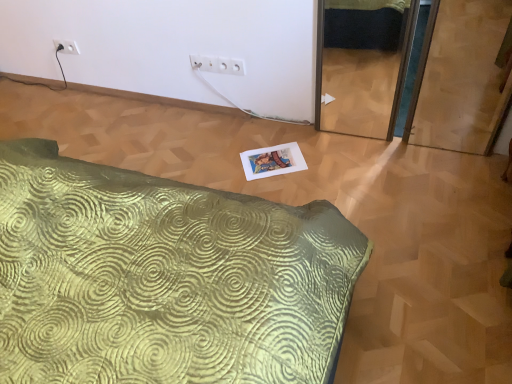
Question: Is white plastic outlet at upper center, the second electric outlet in the back-to-front sequence, further to camera compared to white plastic electric outlet at upper left, placed as the 1th electric outlet when sorted from left to right?

Choices:
 (A) no
 (B) yes

Answer: (A)

Question: From the image's perspective, would you say white plastic outlet at upper center, which appears as the 1th electric outlet when viewed from the right, is shown under white plastic electric outlet at upper left, the second electric outlet viewed from the front?

Choices:
 (A) yes
 (B) no

Answer: (A)

Question: Can white plastic electric outlet at upper left, placed as the 1th electric outlet when sorted from left to right, be found inside white plastic outlet at upper center, which appears as the 1th electric outlet when viewed from the right?

Choices:
 (A) no
 (B) yes

Answer: (A)

Question: Is white plastic outlet at upper center, the first electric outlet viewed from the front, outside white plastic electric outlet at upper left, placed as the 1th electric outlet when sorted from left to right?

Choices:
 (A) yes
 (B) no

Answer: (A)

Question: Does white plastic outlet at upper center, the 2th electric outlet from the top, touch white plastic electric outlet at upper left, arranged as the 2th electric outlet when ordered from the bottom?

Choices:
 (A) no
 (B) yes

Answer: (A)

Question: From a real-world perspective, relative to white plastic outlet at upper center, the 2th electric outlet from the top, is white plastic electric outlet at upper left, positioned as the 1th electric outlet in top-to-bottom order, vertically above or below?

Choices:
 (A) above
 (B) below

Answer: (B)

Question: In terms of width, does white plastic electric outlet at upper left, placed as the 1th electric outlet when sorted from left to right, look wider or thinner when compared to white plastic outlet at upper center, the first electric outlet viewed from the front?

Choices:
 (A) thin
 (B) wide

Answer: (A)

Question: Considering their positions, is white plastic electric outlet at upper left, positioned as the 1th electric outlet in top-to-bottom order, located in front of or behind white plastic outlet at upper center, the first electric outlet viewed from the front?

Choices:
 (A) behind
 (B) front

Answer: (A)

Question: Looking at the image, does white plastic electric outlet at upper left, positioned as the 1th electric outlet in top-to-bottom order, seem bigger or smaller compared to white plastic outlet at upper center, acting as the first electric outlet starting from the bottom?

Choices:
 (A) small
 (B) big

Answer: (A)

Question: Is green textured bed at lower left taller or shorter than white plastic outlet at upper center, which appears as the 1th electric outlet when viewed from the right?

Choices:
 (A) short
 (B) tall

Answer: (A)

Question: In the image, is green textured bed at lower left positioned in front of or behind white plastic outlet at upper center, the first electric outlet viewed from the front?

Choices:
 (A) front
 (B) behind

Answer: (A)

Question: From the image's perspective, relative to white plastic outlet at upper center, which ranks as the 2th electric outlet in left-to-right order, is green textured bed at lower left above or below?

Choices:
 (A) below
 (B) above

Answer: (A)

Question: In the image, is green textured bed at lower left on the left side or the right side of white plastic outlet at upper center, which appears as the 1th electric outlet when viewed from the right?

Choices:
 (A) right
 (B) left

Answer: (B)

Question: From a real-world perspective, is white plastic outlet at upper center, the second electric outlet in the back-to-front sequence, physically located above or below white plastic electric outlet at upper left, placed as the first electric outlet when sorted from back to front?

Choices:
 (A) above
 (B) below

Answer: (A)

Question: Based on their sizes in the image, would you say white plastic outlet at upper center, the second electric outlet in the back-to-front sequence, is bigger or smaller than white plastic electric outlet at upper left, placed as the 1th electric outlet when sorted from left to right?

Choices:
 (A) big
 (B) small

Answer: (A)